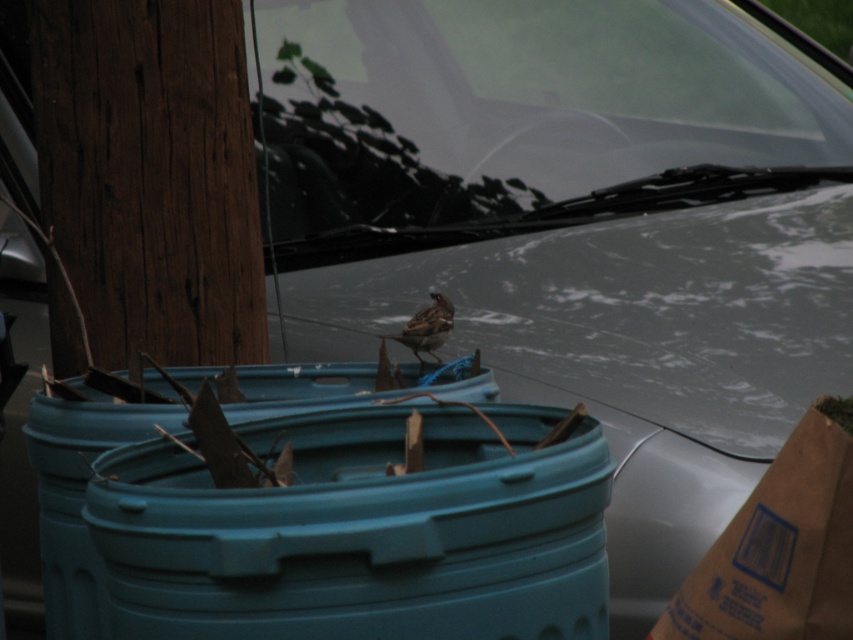
Question: Which is farther from the brown speckled sparrow at center?

Choices:
 (A) brown paper bag at upper right
 (B) clear glass windshield at upper center

Answer: (A)

Question: Which point is farther to the camera?

Choices:
 (A) clear glass windshield at upper center
 (B) brown paper bag at upper right
 (C) brown speckled sparrow at center

Answer: (A)

Question: Can you confirm if clear glass windshield at upper center is bigger than brown speckled sparrow at center?

Choices:
 (A) no
 (B) yes

Answer: (B)

Question: Does clear glass windshield at upper center appear on the left side of brown paper bag at upper right?

Choices:
 (A) yes
 (B) no

Answer: (B)

Question: Which object appears closest to the camera in this image?

Choices:
 (A) clear glass windshield at upper center
 (B) brown paper bag at upper right
 (C) brown speckled sparrow at center

Answer: (B)

Question: Can you confirm if brown paper bag at upper right is positioned to the right of brown speckled sparrow at center?

Choices:
 (A) no
 (B) yes

Answer: (B)